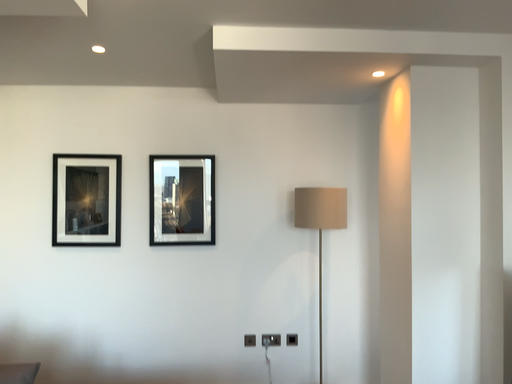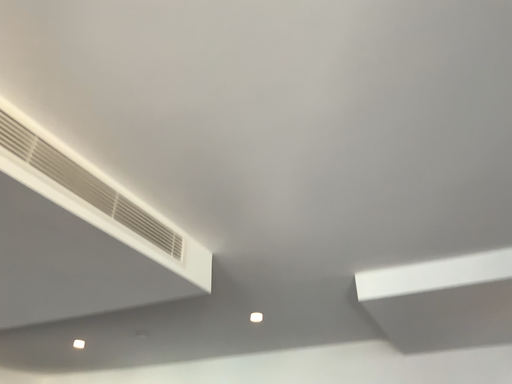
Question: Which way did the camera rotate in the video?

Choices:
 (A) rotated left
 (B) rotated right

Answer: (A)